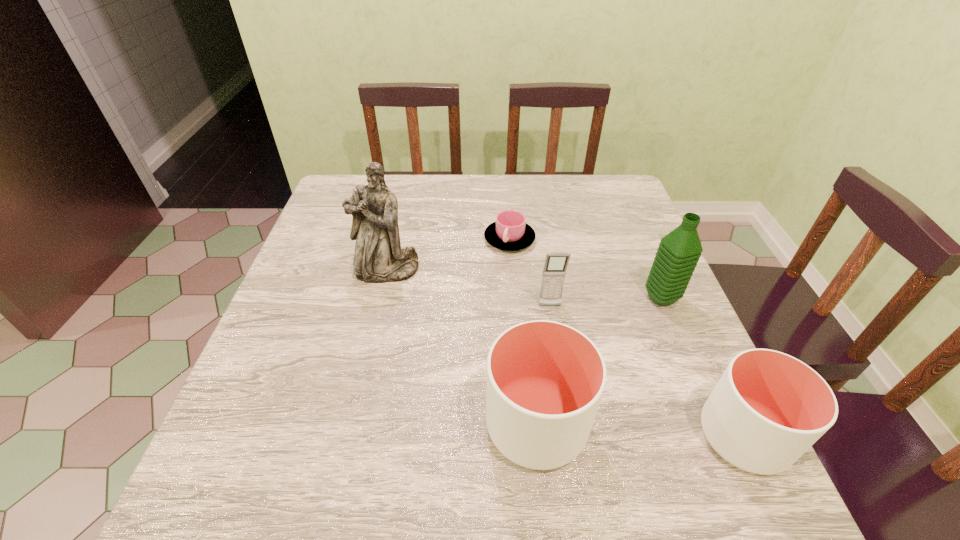
Locate an element on the screen. Image resolution: width=960 pixels, height=540 pixels. the tallest cup is located at coordinates (545, 380).

The width and height of the screenshot is (960, 540). I want to click on the rightmost cup, so click(x=768, y=408).

Identify the location of the farthest cup. This screenshot has width=960, height=540. (510, 232).

Where is `the farthest object`? The image size is (960, 540). the farthest object is located at coordinates (510, 232).

Find the location of `the tallest object`. the tallest object is located at coordinates coord(378,258).

Find the location of a particular element. The width and height of the screenshot is (960, 540). figurine is located at coordinates (378, 258).

This screenshot has width=960, height=540. Find the location of `the fifth shortest object`. the fifth shortest object is located at coordinates (679, 251).

Locate an element on the screen. The height and width of the screenshot is (540, 960). cellular telephone is located at coordinates (556, 262).

This screenshot has width=960, height=540. I want to click on vacant space located 0.090m on the left of the tallest cup, so click(435, 425).

Image resolution: width=960 pixels, height=540 pixels. I want to click on free spot located on the left of the rightmost cup, so click(665, 436).